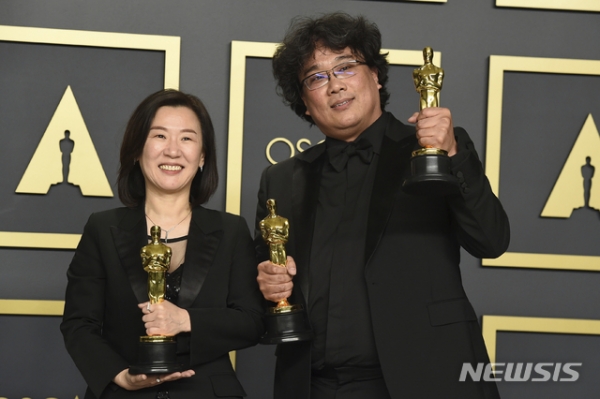
At what (x,y) coordinates should I click in order to perform the action: click on gold border. Please return your answer as a coordinate pair (x, y). Looking at the image, I should click on (167, 48), (237, 80), (492, 89), (523, 5), (35, 305), (510, 320).